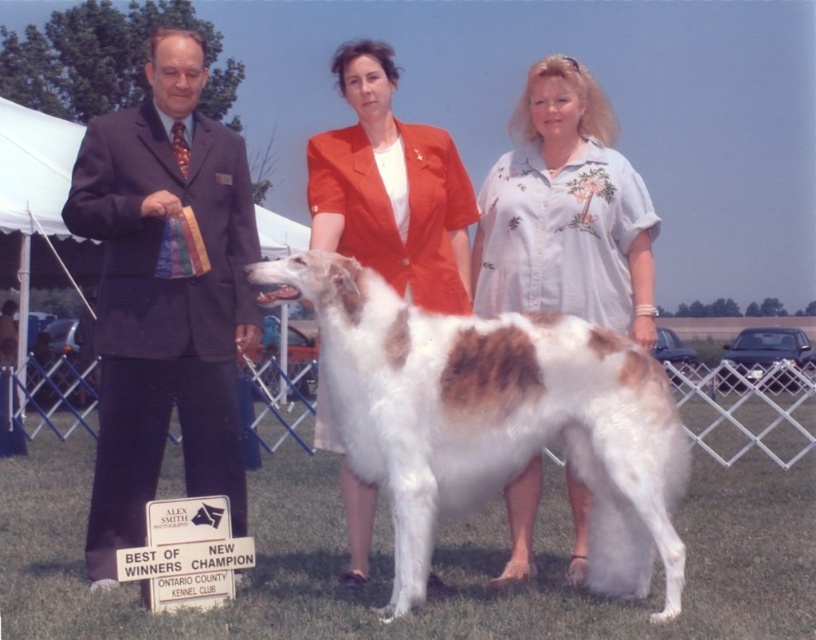
Question: Is white fur at center above light blue floral blouse at center?

Choices:
 (A) yes
 (B) no

Answer: (B)

Question: Does light blue floral blouse at center have a lesser width compared to matte orange blazer at center?

Choices:
 (A) no
 (B) yes

Answer: (A)

Question: Which object appears farthest from the camera in this image?

Choices:
 (A) dark suit at left
 (B) light blue floral blouse at center
 (C) matte orange blazer at center

Answer: (C)

Question: Among these objects, which one is nearest to the camera?

Choices:
 (A) white fur at center
 (B) dark suit at left

Answer: (A)

Question: Does dark suit at left appear on the right side of light blue floral blouse at center?

Choices:
 (A) no
 (B) yes

Answer: (A)

Question: Among these objects, which one is farthest from the camera?

Choices:
 (A) light blue floral blouse at center
 (B) matte orange blazer at center
 (C) dark suit at left
 (D) white fur at center

Answer: (B)